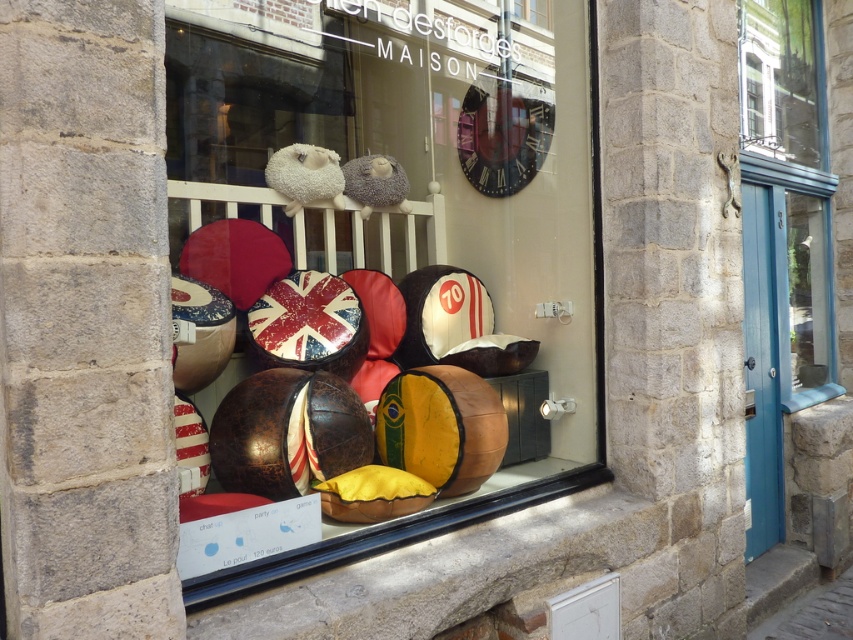
You are standing in front of the storefront window display. You want to exit through the door. Where should you look to find the blue glass door at right?

The blue glass door at right is located at point coordinates of (788, 193).

You are a customer looking at the storefront window display. You notice the leather pillows at center and the clear glass window at upper right. Which object is positioned lower in the display?

The leather pillows at center are positioned lower than the clear glass window at upper right, as they are located below it.